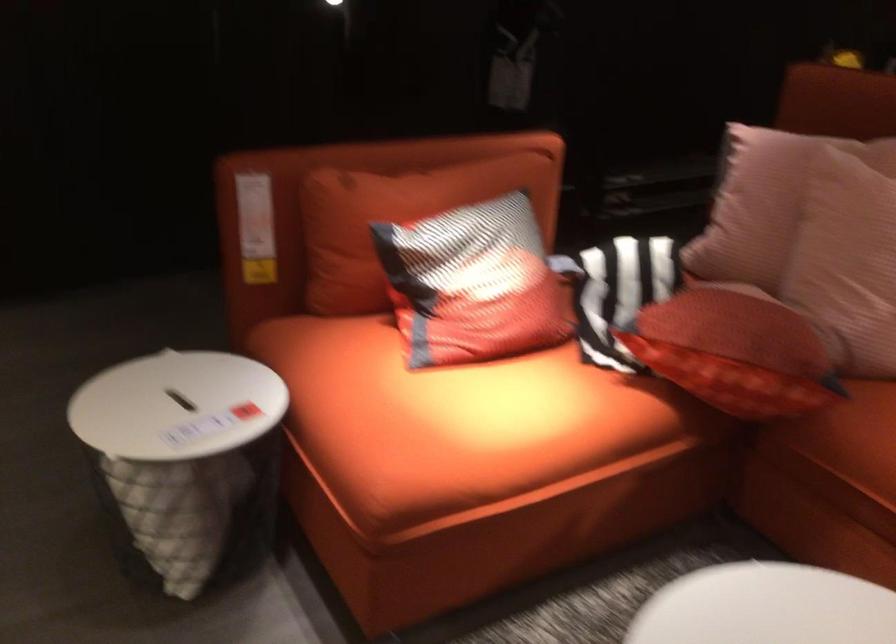
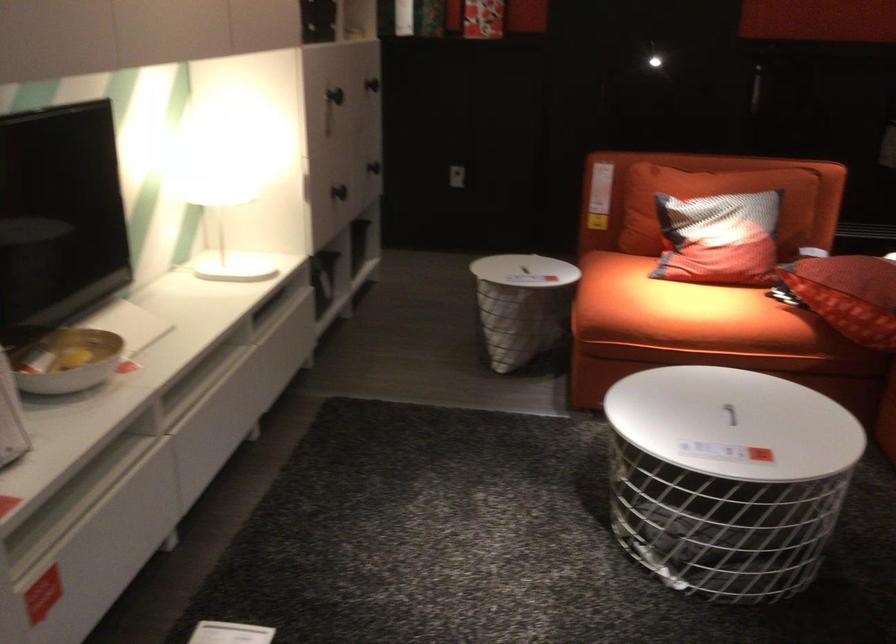
The point at (x=501, y=436) is marked in the first image. Where is the corresponding point in the second image?

(684, 312)